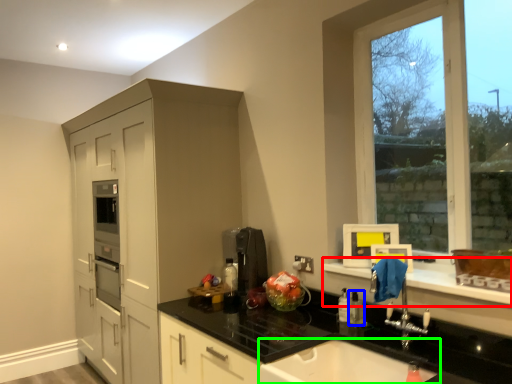
Question: Which is nearer to the window sill (highlighted by a red box)? toiletry (highlighted by a blue box) or sink (highlighted by a green box).

Choices:
 (A) toiletry
 (B) sink

Answer: (A)